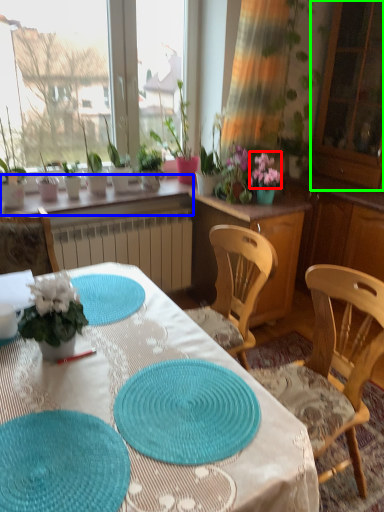
Question: Based on their relative distances, which object is nearer to flower (highlighted by a red box)? Choose from window sill (highlighted by a blue box) and screen door (highlighted by a green box).

Choices:
 (A) window sill
 (B) screen door

Answer: (A)